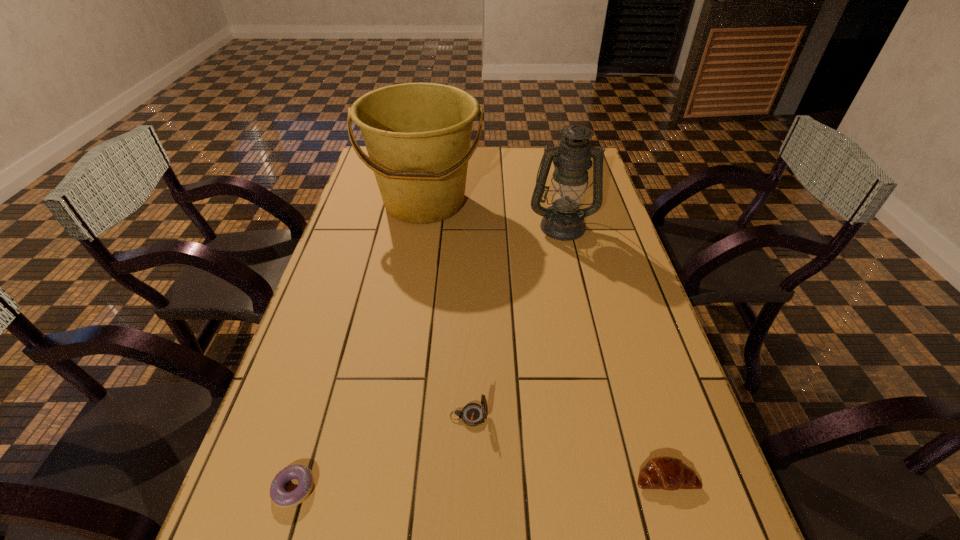
You are a GUI agent. You are given a task and a screenshot of the screen. Output one action in this format:
    pyautogui.click(x=<x>, y=<y>)
    Task: Click on the bucket
    
    Given the screenshot: What is the action you would take?
    pyautogui.click(x=417, y=135)

Locate an element on the screen. The width and height of the screenshot is (960, 540). oil lamp is located at coordinates (563, 220).

I want to click on the third nearest object, so click(x=473, y=414).

Where is `the third tallest object`? This screenshot has height=540, width=960. the third tallest object is located at coordinates (473, 414).

Where is `the fourth tallest object`? This screenshot has height=540, width=960. the fourth tallest object is located at coordinates (667, 473).

Locate an element on the screen. The image size is (960, 540). the shortest object is located at coordinates (281, 498).

Identify the location of free space located 0.250m on the side of the bucket with the handle. (410, 292).

Identify the location of free space located on the back of the oil lamp. (547, 158).

Where is `blank space located on the face of the third tallest object`? blank space located on the face of the third tallest object is located at coordinates (588, 416).

Where is `free space located on the left of the second shortest object`? This screenshot has height=540, width=960. free space located on the left of the second shortest object is located at coordinates (480, 477).